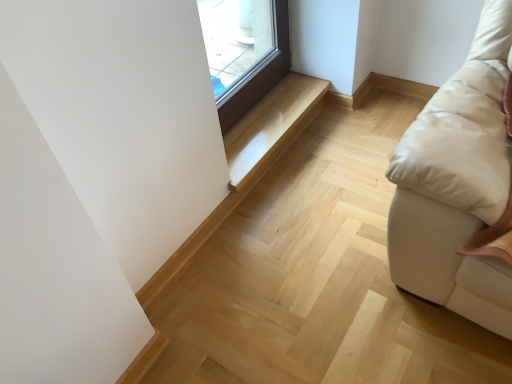
This screenshot has width=512, height=384. Identify the location of free location in front of light wood stairwell at center, placed as the second stairwell when sorted from top to bottom. 304,302.